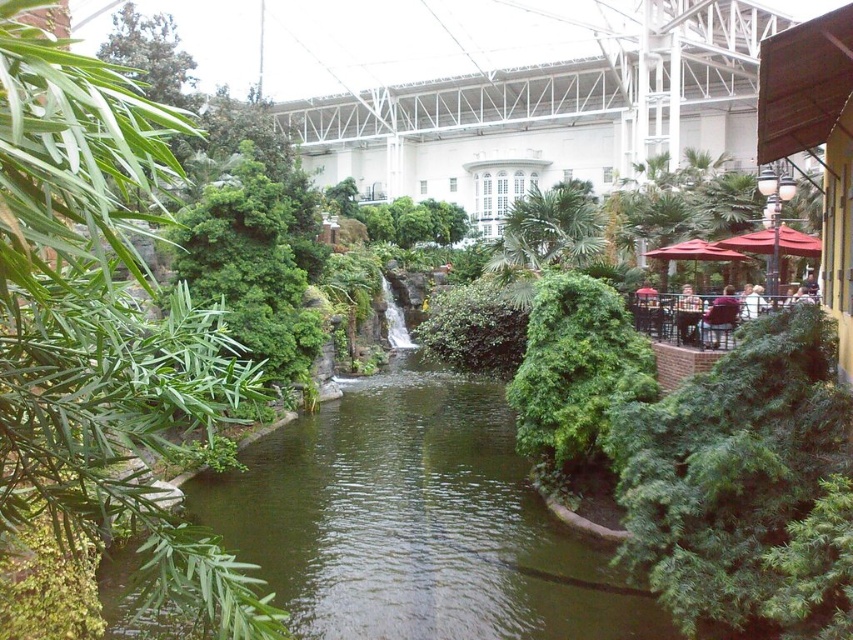
Question: Is green leafy tree at left below green leafy palm tree at center?

Choices:
 (A) yes
 (B) no

Answer: (A)

Question: Can you confirm if green leafy tree at left is bigger than green leafy palm tree at center?

Choices:
 (A) yes
 (B) no

Answer: (A)

Question: Is green leafy tree at left positioned before red fabric umbrella at right?

Choices:
 (A) no
 (B) yes

Answer: (B)

Question: Which point is closer to the camera taking this photo?

Choices:
 (A) (65, 301)
 (B) (549, 221)

Answer: (A)

Question: Estimate the real-world distances between objects in this image. Which object is closer to the green leafy tree at left?

Choices:
 (A) green leafy palm tree at center
 (B) red fabric umbrella at right

Answer: (A)

Question: Which object appears farthest from the camera in this image?

Choices:
 (A) green leafy palm tree at center
 (B) red fabric umbrella at right

Answer: (A)